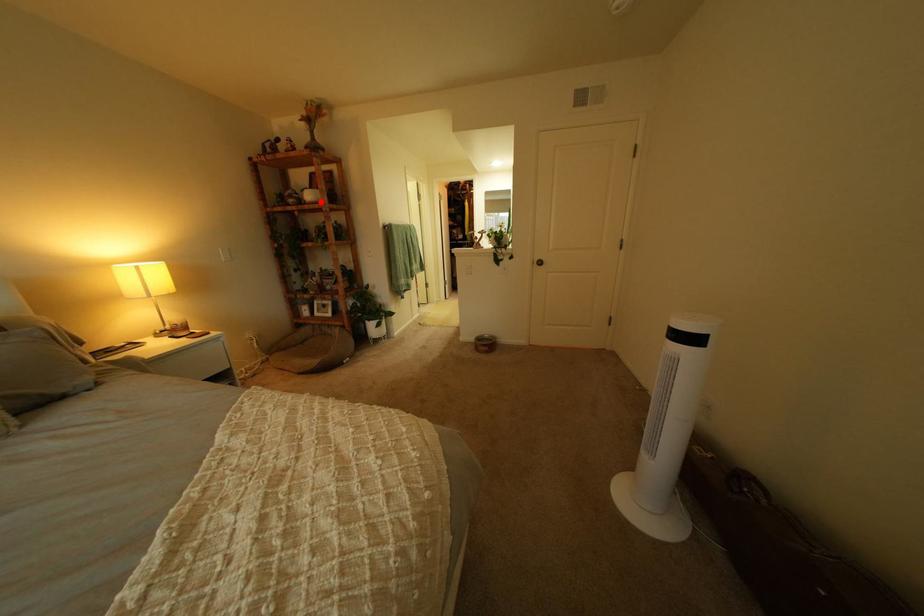
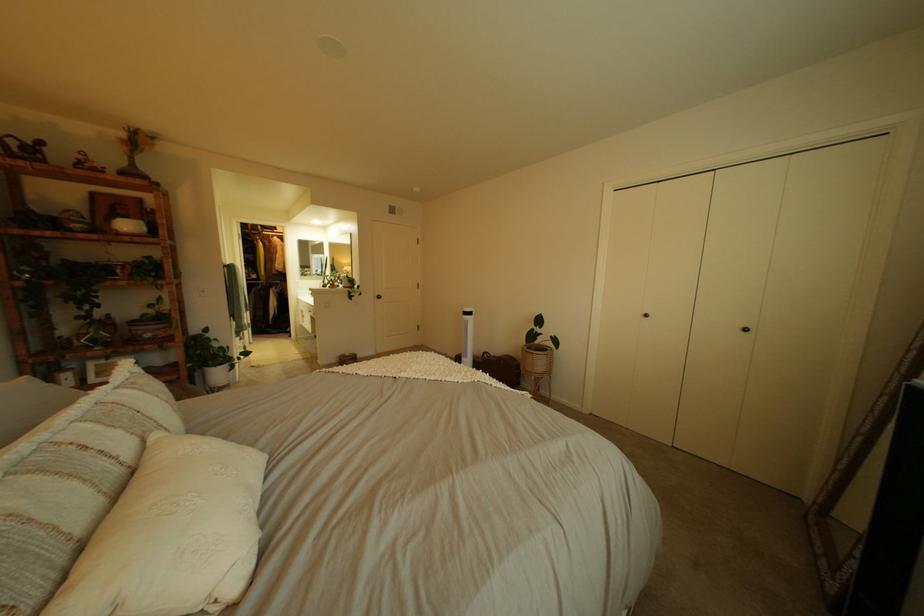
Find the pixel in the second image that matches the highlighted location in the first image.

(132, 232)